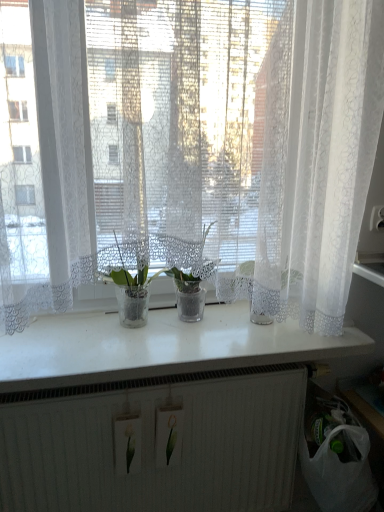
Find the location of a particular element. This screenshot has height=512, width=384. free location to the right of clear glass vase at center, acting as the second houseplant starting from the right is located at coordinates (193, 338).